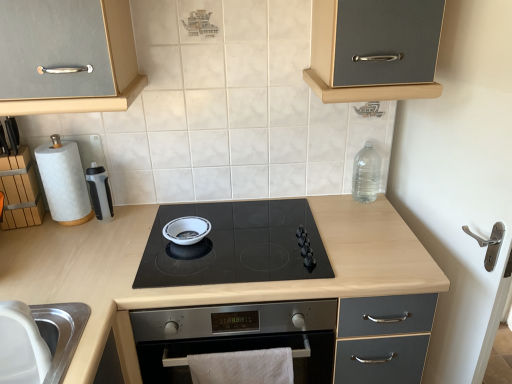
You are a GUI agent. You are given a task and a screenshot of the screen. Output one action in this format:
    pyautogui.click(x=<x>, y=<y>)
    Task: Click on the wooden block at left
    The image size is (512, 384).
    Given the screenshot: What is the action you would take?
    pyautogui.click(x=20, y=191)

At what (x,y) coordinates should I click in order to perform the action: click on clear plastic bottle at upper right. Please return your answer as a coordinate pair (x, y). This screenshot has height=384, width=512. Looking at the image, I should click on (366, 174).

The height and width of the screenshot is (384, 512). Describe the element at coordinates (243, 367) in the screenshot. I see `white cotton towel at lower center` at that location.

Identify the location of white paper towel at left. This screenshot has height=384, width=512. (64, 181).

What is the approximate width of white glossy bowl at center?

20.04 centimeters.

This screenshot has height=384, width=512. What do you see at coordinates (234, 245) in the screenshot? I see `black glass cooktop at center` at bounding box center [234, 245].

Where is `wooden block at left`? wooden block at left is located at coordinates (20, 191).

Who is taller, black glass cooktop at center or black plastic water bottle at left?

Standing taller between the two is black plastic water bottle at left.

Does black glass cooktop at center have a lesser width compared to black plastic water bottle at left?

No.

Is black glass cooktop at center in front of black plastic water bottle at left?

Yes.

The height and width of the screenshot is (384, 512). I want to click on soup bowl below the wooden block at left (from the image's perspective), so click(186, 230).

From the image's perspective, is wooden block at left over white glossy bowl at center?

Correct, wooden block at left appears higher than white glossy bowl at center in the image.

Considering the positions of objects wooden block at left and white glossy bowl at center in the image provided, who is more to the right, wooden block at left or white glossy bowl at center?

white glossy bowl at center.

Which object is wider, white paper towel at left or black glass cooktop at center?

With larger width is black glass cooktop at center.

Is white paper towel at left positioned beyond the bounds of black glass cooktop at center?

Yes, white paper towel at left is outside of black glass cooktop at center.

Is white paper towel at left aimed at black glass cooktop at center?

No, white paper towel at left is not aimed at black glass cooktop at center.

Considering the positions of point (53, 173) and point (297, 252), is point (53, 173) closer or farther from the camera than point (297, 252)?

Point (53, 173) appears to be farther away from the viewer than point (297, 252).

Considering the relative sizes of black plastic water bottle at left and black glass cooktop at center in the image provided, is black plastic water bottle at left taller than black glass cooktop at center?

Correct, black plastic water bottle at left is much taller as black glass cooktop at center.

From the image's perspective, is black plastic water bottle at left located above black glass cooktop at center?

Indeed, from the image's perspective, black plastic water bottle at left is shown above black glass cooktop at center.

From the picture: In terms of size, does black plastic water bottle at left appear bigger or smaller than black glass cooktop at center?

Clearly, black plastic water bottle at left is smaller in size than black glass cooktop at center.

From a real-world perspective, is white paper towel at left over white cotton towel at lower center?

Yes, from a real-world perspective, white paper towel at left is on top of white cotton towel at lower center.

Does white paper towel at left touch white cotton towel at lower center?

There is a gap between white paper towel at left and white cotton towel at lower center.

Is white paper towel at left looking in the opposite direction of white cotton towel at lower center?

No.

This screenshot has width=512, height=384. Find the location of `bath towel on the right of white paper towel at left`. bath towel on the right of white paper towel at left is located at coordinates (243, 367).

From a real-world perspective, is clear plastic bottle at upper right on black glass cooktop at center?

Yes, from a real-world perspective, clear plastic bottle at upper right is over black glass cooktop at center

From the image's perspective, is clear plastic bottle at upper right on black glass cooktop at center?

Yes.

Is clear plastic bottle at upper right turned away from black glass cooktop at center?

No, clear plastic bottle at upper right's orientation is not away from black glass cooktop at center.

Is point (356, 164) positioned behind point (283, 252)?

That is True.

Does white cotton towel at lower center turn towards black glass cooktop at center?

No, white cotton towel at lower center is not oriented towards black glass cooktop at center.

Does white cotton towel at lower center appear on the right side of black glass cooktop at center?

Correct, you'll find white cotton towel at lower center to the right of black glass cooktop at center.

What's the angular difference between white cotton towel at lower center and black glass cooktop at center's facing directions?

white cotton towel at lower center and black glass cooktop at center are facing 1.99 degrees away from each other.

From the image's perspective, who appears lower, white cotton towel at lower center or black glass cooktop at center?

white cotton towel at lower center, from the image's perspective.

The width and height of the screenshot is (512, 384). Identify the location of gas stove on the right of the black plastic water bottle at left. (234, 245).

The height and width of the screenshot is (384, 512). What are the coordinates of `cabinetry on the left of white glossy bowl at center` in the screenshot? It's located at (20, 191).

Looking at the image, which one is located further to matte gray cabinet at upper right, white paper towel at left or stainless steel sink at lower left?

Among the two, white paper towel at left is located further to matte gray cabinet at upper right.

Estimate the real-world distances between objects in this image. Which object is further from black plastic water bottle at left, matte gray cabinet at upper right or white cotton towel at lower center?

matte gray cabinet at upper right is further to black plastic water bottle at left.

Based on their spatial positions, is black glass cooktop at center or matte gray cabinet at upper right closer to white glossy bowl at center?

Among the two, black glass cooktop at center is located nearer to white glossy bowl at center.

From the image, which object appears to be farther from white glossy bowl at center, light wood/black glass at center or matte gray cabinet at upper right?

matte gray cabinet at upper right lies further to white glossy bowl at center than the other object.

Considering their positions, is light wood/black glass at center positioned further to stainless steel sink at lower left than matte gray cabinet at upper right?

The object further to stainless steel sink at lower left is matte gray cabinet at upper right.

From the image, which object appears to be nearer to wooden block at left, light wood/black glass at center or white cotton towel at lower center?

light wood/black glass at center.

Based on their spatial positions, is white cotton towel at lower center or clear plastic bottle at upper right closer to stainless steel sink at lower left?

white cotton towel at lower center.

From the image, which object appears to be farther from black plastic water bottle at left, black glass cooktop at center or white paper towel at left?

The object further to black plastic water bottle at left is black glass cooktop at center.

Locate an element on the screen. The height and width of the screenshot is (384, 512). soup bowl between wooden block at left and black glass cooktop at center in the horizontal direction is located at coordinates (186, 230).

You are a GUI agent. You are given a task and a screenshot of the screen. Output one action in this format:
    pyautogui.click(x=<x>, y=<y>)
    Task: Click on the kitchen appliance between wooden block at left and matte gray cabinet at upper right in the horizontal direction
    This screenshot has width=512, height=384.
    Given the screenshot: What is the action you would take?
    pyautogui.click(x=61, y=333)

Find the location of a particular element. gas stove situated between stainless steel sink at lower left and clear plastic bottle at upper right from left to right is located at coordinates pyautogui.click(x=234, y=245).

You are a GUI agent. You are given a task and a screenshot of the screen. Output one action in this format:
    pyautogui.click(x=<x>, y=<y>)
    Task: Click on the soup bowl positioned between stainless steel sink at lower left and white paper towel at left from near to far
    
    Given the screenshot: What is the action you would take?
    pyautogui.click(x=186, y=230)